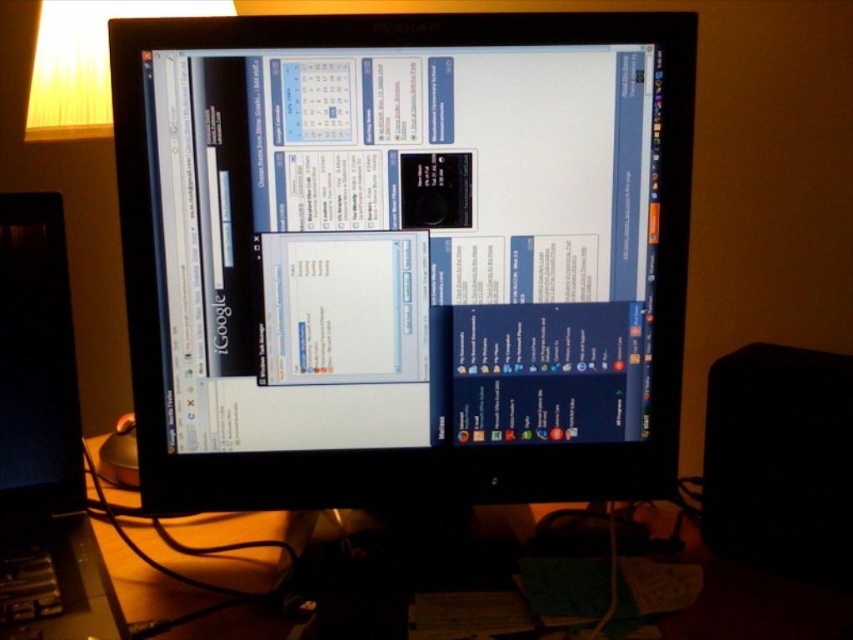
You are trying to reach the point at coordinates (625, 120) on the desk. Your hand is currently at 26 inches from the camera. Can you reach it without moving your arm?

The point at coordinates (625, 120) is 28.07 inches from the camera, which is farther than your current hand position at 26 inches. Therefore, you would need to extend your arm further to reach it.

You are a technician trying to fix a mouse that is not working. The mouse is located at point (76, 392). You have a replacement mouse at point (521, 220). Which mouse should you pick up first to replace the broken one?

You should pick up the replacement mouse at point (521, 220) first because it is in front of the broken mouse at point (76, 392), making it more accessible.